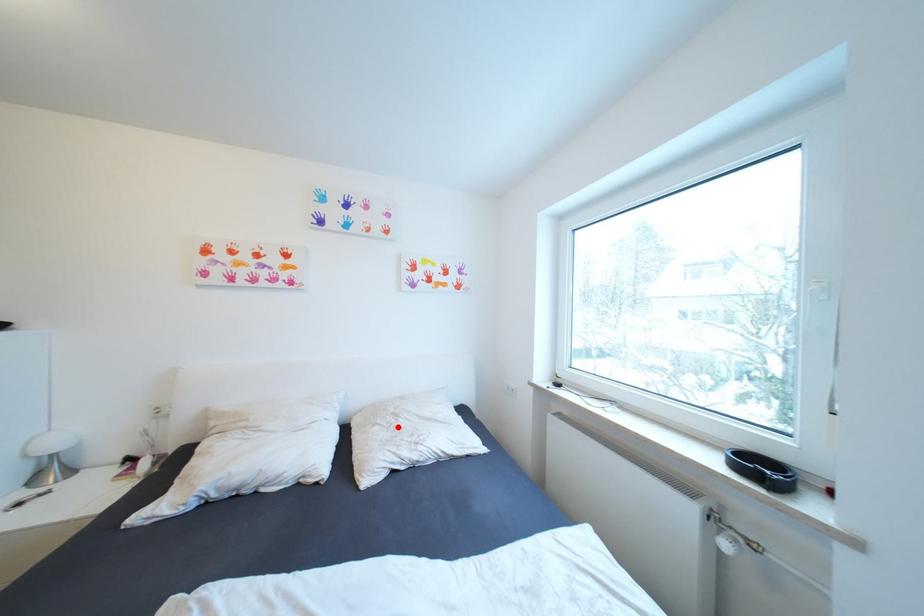
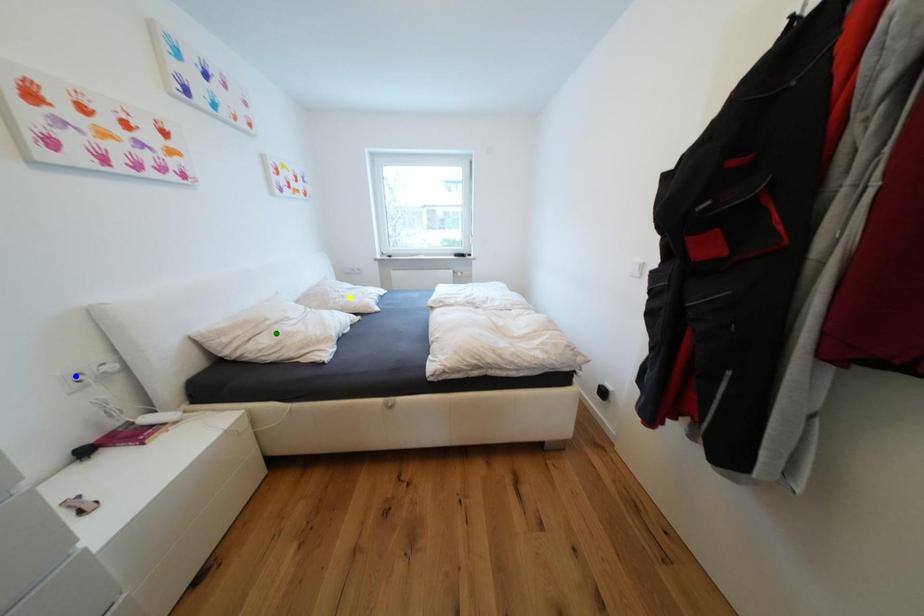
Question: I am providing you with two images of the same scene from different viewpoints. A red point is marked on the first image. You are given multiple points on the second image. Which spot in image 2 lines up with the point in image 1?

Choices:
 (A) blue point
 (B) green point
 (C) yellow point

Answer: (C)